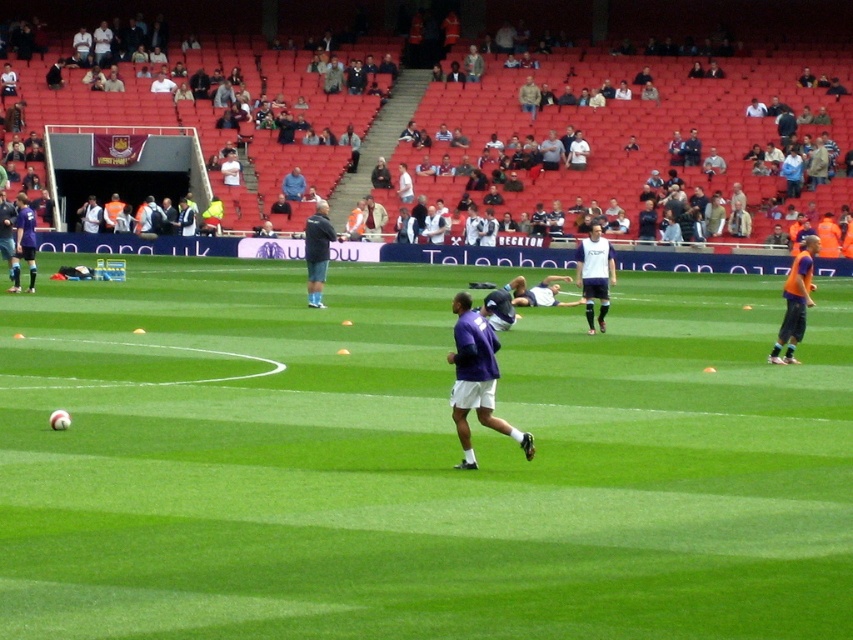
You are a soccer coach analyzing the training session. You notice two points marked on the field at coordinates point (604, 240) and point (9, 289). Which point is nearer to the coach standing at the center of the field?

Point (604, 240) is closer to the viewer than point (9, 289). Since the coach is at the center, the point closer to them would be point (604, 240).

You are a soccer coach analyzing the training session. You notice the green grass field at center and the dark blue jacket at center. Which object occupies a larger area in the image?

The green grass field at center is bigger than the dark blue jacket at center, so the green grass field at center occupies a larger area in the image.

You are a coach analyzing a soccer training session. You notice a point marked at coordinates (595, 273) on the field. What object or player is located at that specific coordinate?

The point at coordinates (595, 273) indicates the location of the white matte jersey at center.